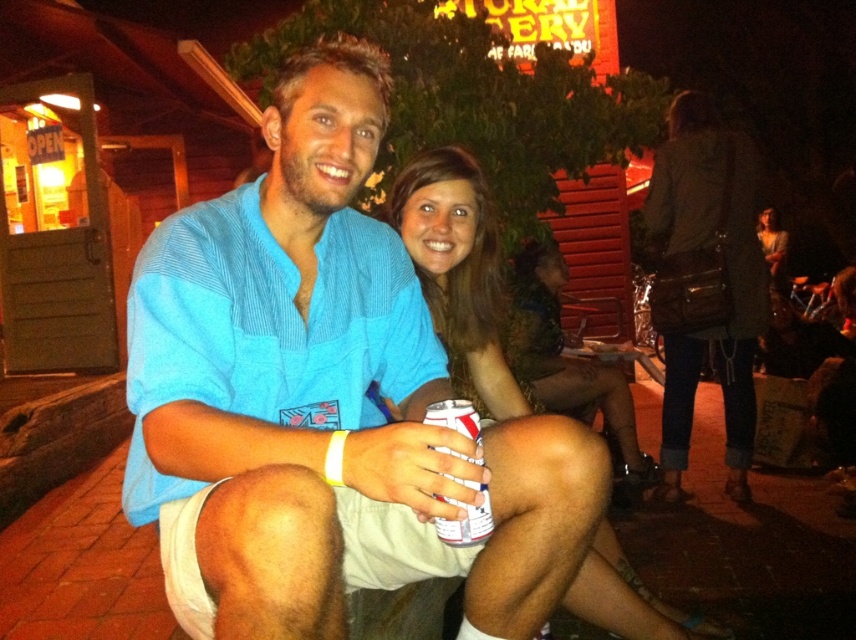
You are organizing a clothing donation drive and need to categorize items by size. You have a blue cotton shirt at center and a matte green dress at center. Which item should you place in the large size bin?

The blue cotton shirt at center is bigger than the matte green dress at center, so you should place the blue cotton shirt at center in the large size bin.